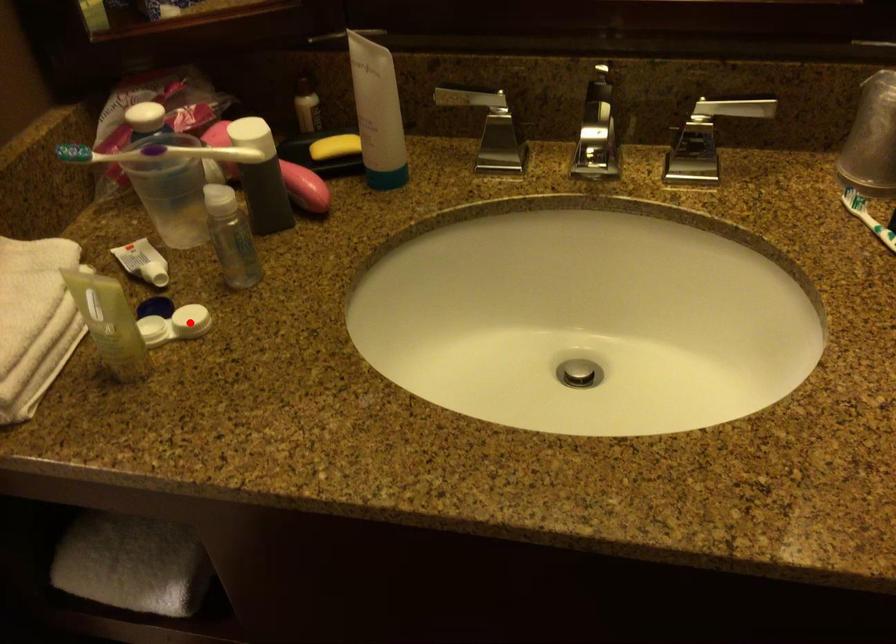
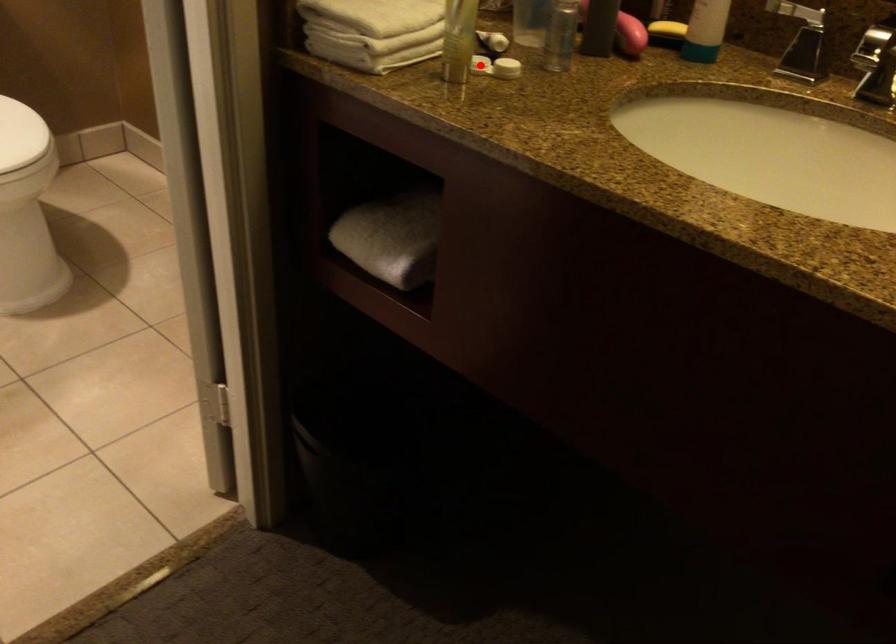
I am providing you with two images of the same scene from different viewpoints. A red point is marked on the first image and another point is marked on the second image. Are the points marked in image1 and image2 representing the same 3D position?

No